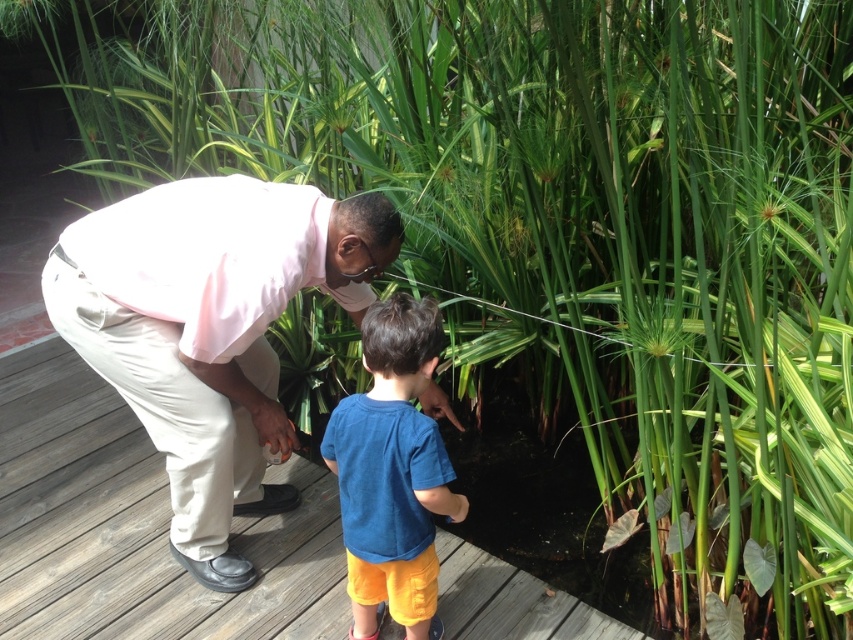
Which is more to the right, pink cotton shirt at center or blue cotton shirt at center?

blue cotton shirt at center

This screenshot has width=853, height=640. What do you see at coordinates (210, 330) in the screenshot? I see `pink cotton shirt at center` at bounding box center [210, 330].

This screenshot has width=853, height=640. I want to click on pink cotton shirt at center, so click(210, 330).

Can you confirm if wooden deck at center is smaller than blue cotton shirt at center?

No.

Does wooden deck at center have a lesser height compared to blue cotton shirt at center?

Yes, wooden deck at center is shorter than blue cotton shirt at center.

Which is behind, point (84, 600) or point (422, 513)?

Positioned behind is point (84, 600).

Locate an element on the screen. The width and height of the screenshot is (853, 640). wooden deck at center is located at coordinates (137, 525).

Is wooden deck at center thinner than pink cotton shirt at center?

No, wooden deck at center is not thinner than pink cotton shirt at center.

Who is more distant from viewer, (x=281, y=596) or (x=219, y=445)?

The point (x=281, y=596) is behind.

Does point (300, 611) come farther from viewer compared to point (228, 257)?

That is True.

The height and width of the screenshot is (640, 853). In order to click on wooden deck at center in this screenshot , I will do `click(137, 525)`.